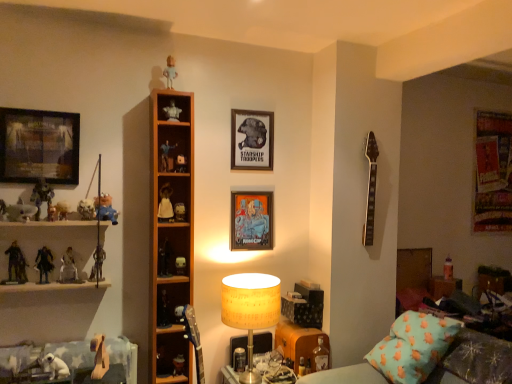
The image size is (512, 384). What do you see at coordinates (413, 347) in the screenshot?
I see `teal fabric pillow at lower right` at bounding box center [413, 347].

This screenshot has height=384, width=512. What do you see at coordinates (166, 155) in the screenshot? I see `matte plastic action figure at center-left, which ranks as the twelfth toy in left-to-right order` at bounding box center [166, 155].

In order to click on matte paper picture frame at center, placed as the 3th picture frame when sorted from left to right in this screenshot , I will do `click(252, 140)`.

Measure the distance between matte plastic toy at center, the 5th toy in the right-to-left sequence, and camera.

matte plastic toy at center, the 5th toy in the right-to-left sequence, is 2.20 meters from camera.

The width and height of the screenshot is (512, 384). Describe the element at coordinates (68, 268) in the screenshot. I see `metallic silver figure at left, which is the 6th toy in left-to-right order` at that location.

The image size is (512, 384). Find the location of `teal fabric pillow at lower right`. teal fabric pillow at lower right is located at coordinates (413, 347).

Does plastic blue figure at upper center, the 13th toy in the left-to-right sequence, appear on the right side of white fabric bed frame at lower left?

Yes.

Which object is closer to the camera, plastic blue figure at upper center, the 13th toy in the left-to-right sequence, or white fabric bed frame at lower left?

white fabric bed frame at lower left is closer to the camera.

From a real-world perspective, who is located lower, plastic blue figure at upper center, which is the 7th toy in right-to-left order, or white fabric bed frame at lower left?

From a 3D spatial view, white fabric bed frame at lower left is below.

Can we say plastic blue figure at upper center, which is the 7th toy in right-to-left order, lies outside white fabric bed frame at lower left?

Yes, plastic blue figure at upper center, which is the 7th toy in right-to-left order, is not within white fabric bed frame at lower left.

From a real-world perspective, is metallic silver figurine at left, which is the first toy in left-to-right order, physically above metallic silver figure at left, which is counted as the 18th toy, starting from the right?

Yes, from a real-world perspective, metallic silver figurine at left, which is the first toy in left-to-right order, is above metallic silver figure at left, which is counted as the 18th toy, starting from the right.

Would you say metallic silver figurine at left, placed as the 19th toy when sorted from right to left, is a long distance from metallic silver figure at left, positioned as the 2th toy in left-to-right order?

metallic silver figurine at left, placed as the 19th toy when sorted from right to left, is actually quite close to metallic silver figure at left, positioned as the 2th toy in left-to-right order.

Is metallic silver figurine at left, which is the first toy in left-to-right order, looking in the opposite direction of metallic silver figure at left, positioned as the 2th toy in left-to-right order?

No, metallic silver figurine at left, which is the first toy in left-to-right order,'s orientation is not away from metallic silver figure at left, positioned as the 2th toy in left-to-right order.

Between point (1, 201) and point (13, 275), which one is positioned in front?

Positioned in front is point (1, 201).

Who is bigger, matte plastic toy at center, which is the second toy from right to left, or translucent plastic bottle at lower center, the nineteenth toy when ordered from left to right?

Bigger between the two is translucent plastic bottle at lower center, the nineteenth toy when ordered from left to right.

From the image's perspective, which one is positioned lower, matte plastic toy at center, which is counted as the eighteenth toy, starting from the left, or translucent plastic bottle at lower center, which ranks as the first toy in right-to-left order?

From the image's view, translucent plastic bottle at lower center, which ranks as the first toy in right-to-left order, is below.

Looking at this image, considering the sizes of matte plastic toy at center, which is counted as the eighteenth toy, starting from the left, and translucent plastic bottle at lower center, the nineteenth toy when ordered from left to right, in the image, is matte plastic toy at center, which is counted as the eighteenth toy, starting from the left, taller or shorter than translucent plastic bottle at lower center, the nineteenth toy when ordered from left to right,?

In the image, matte plastic toy at center, which is counted as the eighteenth toy, starting from the left, appears to be shorter than translucent plastic bottle at lower center, the nineteenth toy when ordered from left to right.

How distant is matte plastic toy at center, which is the second toy from right to left, from translucent plastic bottle at lower center, the nineteenth toy when ordered from left to right?

matte plastic toy at center, which is the second toy from right to left, is 29.96 inches away from translucent plastic bottle at lower center, the nineteenth toy when ordered from left to right.

Would you say metallic silver figurine at left, placed as the 19th toy when sorted from right to left, contains matte plastic elephant at left, the seventh toy viewed from the left?

No, metallic silver figurine at left, placed as the 19th toy when sorted from right to left, does not contain matte plastic elephant at left, the seventh toy viewed from the left.

How many degrees apart are the facing directions of metallic silver figurine at left, which is the first toy in left-to-right order, and matte plastic elephant at left, the seventh toy viewed from the left?

They differ by 1.02 degrees in their facing directions.

Between point (3, 220) and point (79, 211), which one is positioned in front?

The point (3, 220) is in front.

Would you say metallic silver figurine at left, placed as the 19th toy when sorted from right to left, is to the left or to the right of matte plastic elephant at left, the seventh toy viewed from the left, in the picture?

From the image, it's evident that metallic silver figurine at left, placed as the 19th toy when sorted from right to left, is to the left of matte plastic elephant at left, the seventh toy viewed from the left.

Could you tell me if wooden shelf at center, the first shelf from the left, is turned towards white paper lampshade at center?

No, wooden shelf at center, the first shelf from the left, is not oriented towards white paper lampshade at center.

Are wooden shelf at center, the second shelf positioned from the bottom, and white paper lampshade at center beside each other?

wooden shelf at center, the second shelf positioned from the bottom, and white paper lampshade at center are not in contact.

Between wooden shelf at center, the second shelf positioned from the bottom, and white paper lampshade at center, which one appears on the left side from the viewer's perspective?

wooden shelf at center, the second shelf positioned from the bottom, is more to the left.

Considering the sizes of objects matte plastic action figure at center-left, which ranks as the twelfth toy in left-to-right order, and matte paper picture frame at center, the 2th picture frame when ordered from back to front, in the image provided, who is thinner, matte plastic action figure at center-left, which ranks as the twelfth toy in left-to-right order, or matte paper picture frame at center, the 2th picture frame when ordered from back to front,?

matte paper picture frame at center, the 2th picture frame when ordered from back to front.

Which is behind, point (160, 147) or point (245, 165)?

The point (245, 165) is behind.

There is a matte plastic action figure at center-left, which ranks as the twelfth toy in left-to-right order. Identify the location of the 2nd picture frame above it (from the image's perspective). (252, 140).

From the image's perspective, does matte plastic action figure at center-left, which ranks as the twelfth toy in left-to-right order, appear lower than matte paper picture frame at center, the 3th picture frame in the front-to-back sequence?

Yes.

Considering the sizes of metallic figurines at left and metallic silver picture frame at center, arranged as the 3th picture frame when viewed from the back, in the image, is metallic figurines at left wider or thinner than metallic silver picture frame at center, arranged as the 3th picture frame when viewed from the back,?

Considering their sizes, metallic figurines at left looks broader than metallic silver picture frame at center, arranged as the 3th picture frame when viewed from the back.

Is metallic figurines at left positioned with its back to metallic silver picture frame at center, positioned as the 2th picture frame in front-to-back order?

No, metallic figurines at left is not facing away from metallic silver picture frame at center, positioned as the 2th picture frame in front-to-back order.

Which object is closer to the camera taking this photo, metallic figurines at left or metallic silver picture frame at center, positioned as the 2th picture frame in front-to-back order?

metallic figurines at left is more forward.

Based on their positions, is metallic figurines at left located to the left or right of metallic silver picture frame at center, arranged as the 3th picture frame when viewed from the back?

In the image, metallic figurines at left appears on the left side of metallic silver picture frame at center, arranged as the 3th picture frame when viewed from the back.

Locate an element on the screen. Image resolution: width=512 pixels, height=384 pixels. the 11th toy behind the white fabric bed frame at lower left, counting from the anchor's position is located at coordinates (170, 72).

The width and height of the screenshot is (512, 384). I want to click on the 2nd toy in front of the metallic silver figure at left, positioned as the 2th toy in left-to-right order, so click(3, 211).

Which object lies further to the anchor point matte black cube at center, which appears as the 17th toy when viewed from the left, metallic silver picture frame at center, positioned as the 2th picture frame in front-to-back order, or matte plastic action figure at center-left, which appears as the eighth toy when viewed from the right?

The object further to matte black cube at center, which appears as the 17th toy when viewed from the left, is matte plastic action figure at center-left, which appears as the eighth toy when viewed from the right.

Which object lies further to the anchor point matte paper picture frame at center, the 3th picture frame in the front-to-back sequence, metallic silver figure at left, the 14th toy positioned from the right, or matte black cube at center, which appears as the 17th toy when viewed from the left?

Among the two, metallic silver figure at left, the 14th toy positioned from the right, is located further to matte paper picture frame at center, the 3th picture frame in the front-to-back sequence.

Based on the photo, when comparing their distances from matte paper picture frame at center, the 2th picture frame when ordered from back to front, does translucent plastic bottle at lower center, which ranks as the first toy in right-to-left order, or matte plastic toy at center, which is counted as the eighteenth toy, starting from the left, seem closer?

matte plastic toy at center, which is counted as the eighteenth toy, starting from the left.

Which object lies further to the anchor point matte black cube at center, which ranks as the 3th toy in right-to-left order, white matte doll at center, acting as the tenth toy starting from the right, or black plastic figure at left, the sixteenth toy viewed from the right?

black plastic figure at left, the sixteenth toy viewed from the right.

Based on their spatial positions, is white matte figurine at upper center, which ranks as the sixth toy in right-to-left order, or white fabric bed frame at lower left closer to matte plastic toy at center, which is the fifteenth toy in left-to-right order?

The object closer to matte plastic toy at center, which is the fifteenth toy in left-to-right order, is white matte figurine at upper center, which ranks as the sixth toy in right-to-left order.

Looking at the image, which one is located further to white paper lampshade at center, white fabric bed frame at lower left or metallic poster at upper right, the 4th picture frame when ordered from front to back?

metallic poster at upper right, the 4th picture frame when ordered from front to back, is positioned further to the anchor white paper lampshade at center.

Looking at the image, which one is located further to teal fabric couch at lower right, plush blue bear at left, placed as the 11th toy when sorted from right to left, or white paper lampshade at center?

The object further to teal fabric couch at lower right is plush blue bear at left, placed as the 11th toy when sorted from right to left.

When comparing their distances from metallic figurines at left, does wooden shelf at center, the second shelf from the right, or metallic silver figure at left, which ranks as the twelfth toy in right-to-left order, seem further?

wooden shelf at center, the second shelf from the right, is further to metallic figurines at left.

The width and height of the screenshot is (512, 384). What are the coordinates of `collection that lies between matte paper picture frame at center, the 2th picture frame when ordered from back to front, and matte plastic toy at center, which is counted as the eighteenth toy, starting from the left, from top to bottom` in the screenshot? It's located at (58, 247).

Locate an element on the screen. picture frame located between metallic figurines at left and matte paper picture frame at center, placed as the 3th picture frame when sorted from left to right, in the left-right direction is located at coordinates (251, 220).

Image resolution: width=512 pixels, height=384 pixels. What are the coordinates of `toy between wooden at lower center, which is the 1th shelf from bottom to top, and metallic poster at upper right, the 4th picture frame viewed from the left, in the horizontal direction` in the screenshot? It's located at (320, 356).

Identify the location of bed frame between metallic silver figure at left, positioned as the 2th toy in left-to-right order, and metallic silver picture frame at center, which is the 3th picture frame from right to left. (72, 353).